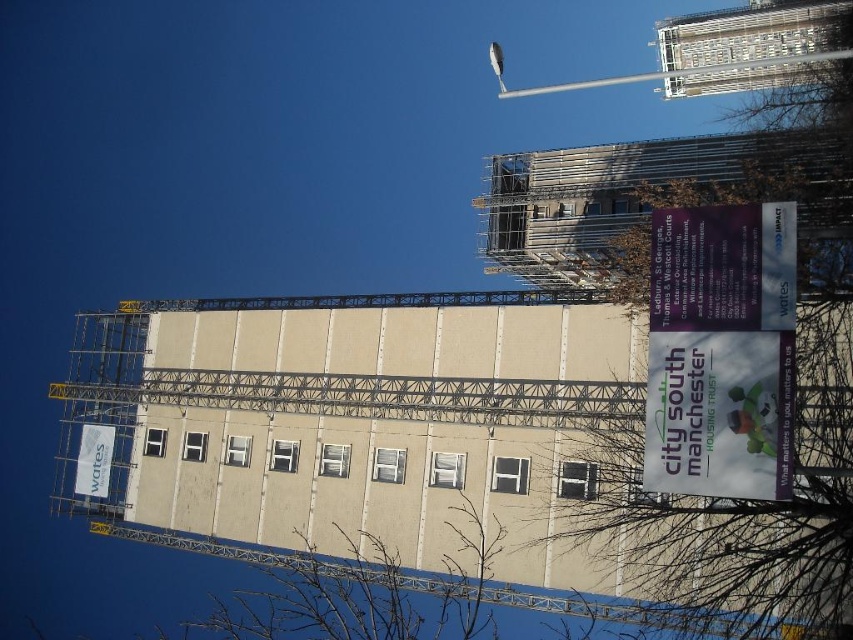
You are a city planner assessing the construction site. You notice the purple paper sign at upper right and the metallic pole at upper center. Which object has a smaller width?

The purple paper sign at upper right has a smaller width than the metallic pole at upper center.

You are standing at the base of the residential building depicted in the image. You want to retrieve the purple paper sign at upper right to read its text. Given that the sign is 46.75 meters away from you, can you reach it without any assistance?

The purple paper sign at upper right is 46.75 meters away from the viewer, so you cannot reach it without assistance as the distance is too far for a person to reach manually.

You are standing at the base of the residential building and looking up at the metallic pole at upper center. If you were to draw a straight line from your eye level to the pole, what would be the coordinates of the point where this line intersects the building facade?

The coordinates of the intersection point would be the same as the metallic pole at upper center, which is at point (654, 72).